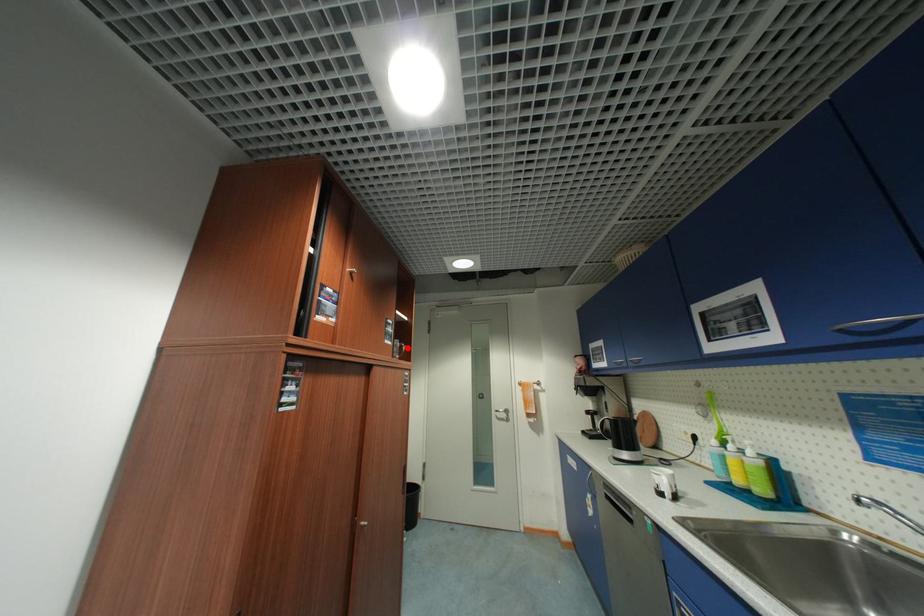
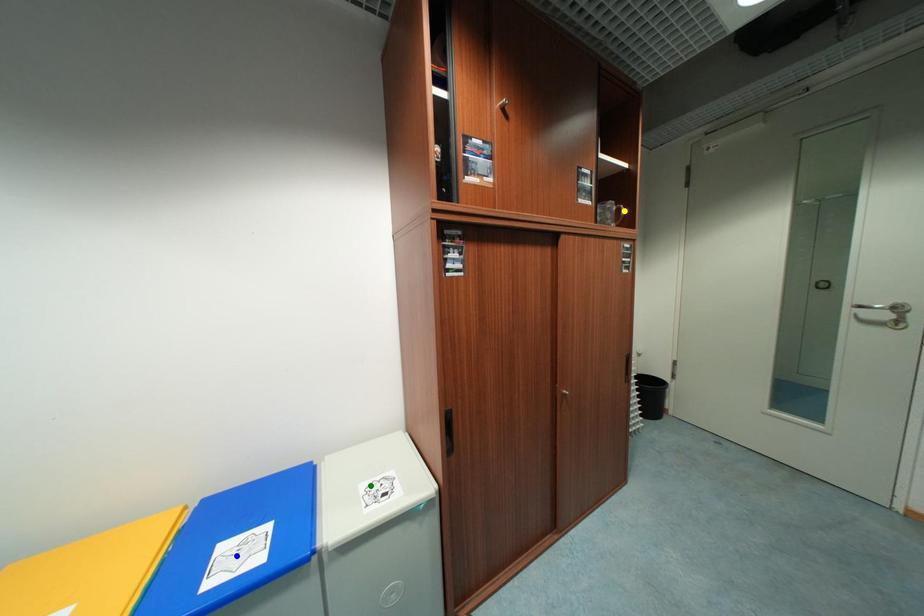
Question: I am providing you with two images of the same scene from different viewpoints. A red point is marked on the first image. You are given multiple points on the second image. Which point in image 2 is actually the same real-world point as the red point in image 1?

Choices:
 (A) yellow point
 (B) green point
 (C) blue point

Answer: (A)